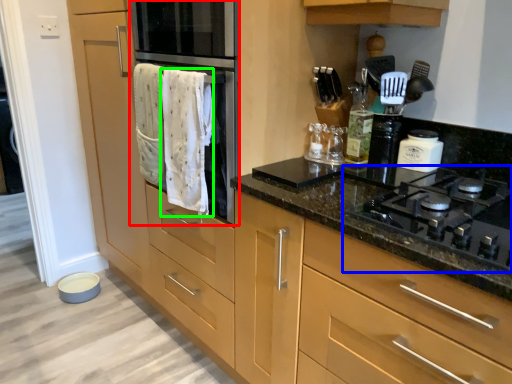
Question: Which is farther away from oven (highlighted by a red box)? gas stove (highlighted by a blue box) or bath towel (highlighted by a green box)?

Choices:
 (A) gas stove
 (B) bath towel

Answer: (A)